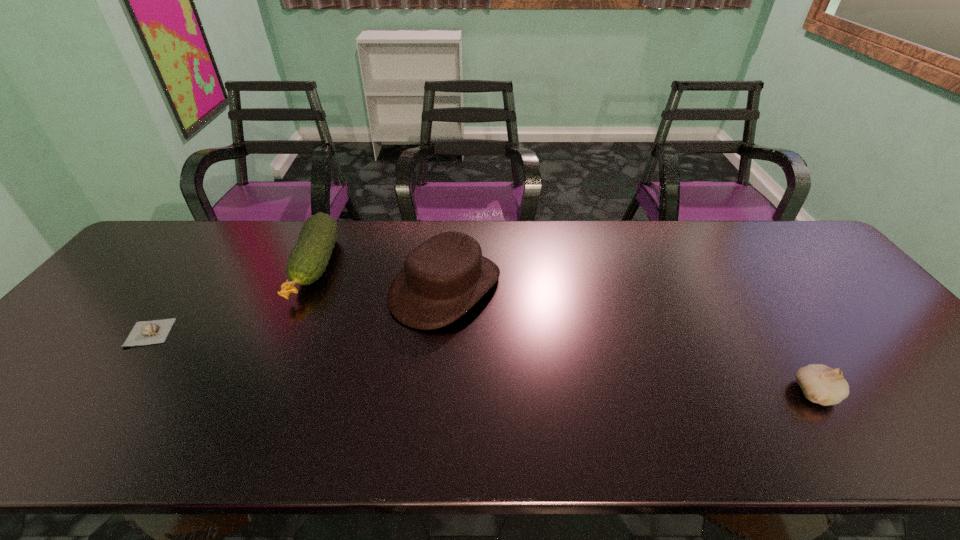
This screenshot has width=960, height=540. Identify the location of object that is the closest to the right garlic. (444, 277).

The width and height of the screenshot is (960, 540). In order to click on vacant area in the image that satisfies the following two spatial constraints: 1. on the front side of the nearer garlic; 2. on the left side of the hat in this screenshot , I will do `click(437, 393)`.

Image resolution: width=960 pixels, height=540 pixels. I want to click on free space that satisfies the following two spatial constraints: 1. at the blossom end of the second object from left to right; 2. on the left side of the second object from right to left, so click(x=305, y=288).

Find the location of a particular element. vacant region that satisfies the following two spatial constraints: 1. at the blossom end of the right garlic; 2. on the left side of the cucumber is located at coordinates (259, 393).

The width and height of the screenshot is (960, 540). Find the location of `free spot that satisfies the following two spatial constraints: 1. at the blossom end of the nearer garlic; 2. on the right side of the cucumber`. free spot that satisfies the following two spatial constraints: 1. at the blossom end of the nearer garlic; 2. on the right side of the cucumber is located at coordinates (259, 393).

Where is `free spot that satisfies the following two spatial constraints: 1. at the blossom end of the taller garlic; 2. on the left side of the second object from left to right`? This screenshot has width=960, height=540. free spot that satisfies the following two spatial constraints: 1. at the blossom end of the taller garlic; 2. on the left side of the second object from left to right is located at coordinates (259, 393).

Image resolution: width=960 pixels, height=540 pixels. I want to click on free spot that satisfies the following two spatial constraints: 1. at the blossom end of the second object from left to right; 2. on the left side of the nearer garlic, so click(x=259, y=393).